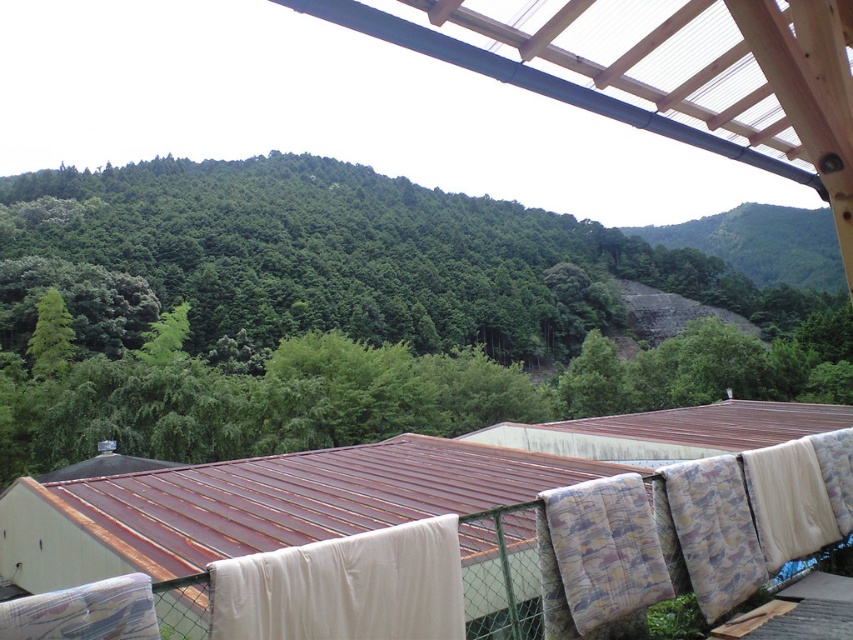
Is green leafy tree at upper center wider than white fabric at lower center?

Yes.

What do you see at coordinates (354, 314) in the screenshot? I see `green leafy tree at upper center` at bounding box center [354, 314].

The height and width of the screenshot is (640, 853). Identify the location of green leafy tree at upper center. (354, 314).

Between rusty metal hut at lower left and white fabric at lower center, which one has more height?

rusty metal hut at lower left

Can you confirm if rusty metal hut at lower left is shorter than white fabric at lower center?

Incorrect, rusty metal hut at lower left's height does not fall short of white fabric at lower center's.

Find the location of a particular element. The width and height of the screenshot is (853, 640). rusty metal hut at lower left is located at coordinates (352, 486).

Find the location of a particular element. This screenshot has width=853, height=640. rusty metal hut at lower left is located at coordinates (352, 486).

Can you confirm if green leafy tree at upper center is taller than rusty metal hut at lower left?

Indeed, green leafy tree at upper center has a greater height compared to rusty metal hut at lower left.

Is point (207, 284) less distant than point (103, 444)?

No, it is not.

Describe the element at coordinates (354, 314) in the screenshot. I see `green leafy tree at upper center` at that location.

This screenshot has height=640, width=853. I want to click on green leafy tree at upper center, so click(x=354, y=314).